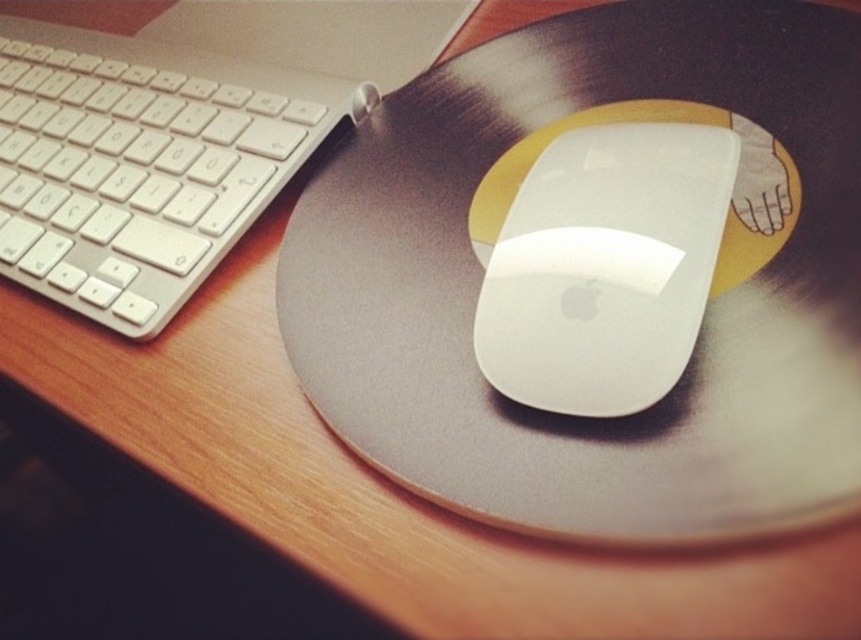
You are setting up your desk and want to place a new wireless charger between the white plastic keyboard at left and the white glossy mouse at center. According to the current arrangement, where should you position the wireless charger so it is between them?

The white plastic keyboard at left is located above the white glossy mouse at center, so to place the wireless charger between them, position it below the keyboard and above the mouse.

You are taking a photo of the workspace and want to focus on both the point at coordinates point (103, 205) and point (527, 307). Which point should you focus on first to ensure both are in focus?

You should focus on point (103, 205) first because it is closer to the camera than point (527, 307). This way, both points will be in focus as the focus will extend from the closer point to the farther one.

Consider the image. You are organizing your desk and want to ensure proper airflow between your white plastic keyboard at left and white glossy mouse at center. Since airflow is better when items are not directly blocking each other, which item is positioned in a way that might obstruct airflow from reaching the other?

The white glossy mouse at center is behind the white plastic keyboard at left, so the keyboard might block airflow from reaching the mouse.